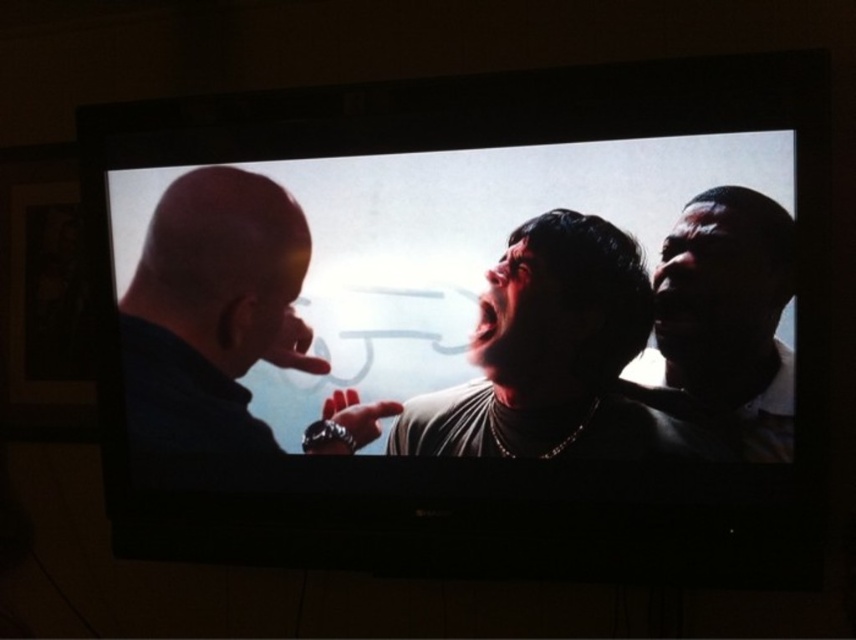
You are a GUI agent. You are given a task and a screenshot of the screen. Output one action in this format:
    pyautogui.click(x=<x>, y=<y>)
    Task: Click on the dark gray shirt at center
    This screenshot has height=640, width=856.
    Given the screenshot: What is the action you would take?
    pyautogui.click(x=554, y=356)

Between dark gray shirt at center and dark skin textured face at right, which one has more height?

With more height is dark skin textured face at right.

This screenshot has height=640, width=856. I want to click on dark gray shirt at center, so click(x=554, y=356).

Is bald head at left bigger than dark skin textured face at right?

Correct, bald head at left is larger in size than dark skin textured face at right.

Does bald head at left have a smaller size compared to dark skin textured face at right?

Actually, bald head at left might be larger than dark skin textured face at right.

The height and width of the screenshot is (640, 856). In order to click on bald head at left in this screenshot , I will do `click(214, 310)`.

Who is more forward, (250, 228) or (693, 428)?

Point (693, 428)

Is point (195, 368) in front of point (605, 282)?

That is False.

Is point (177, 410) closer to camera compared to point (509, 381)?

No, (177, 410) is further to viewer.

Locate an element on the screen. bald head at left is located at coordinates (214, 310).